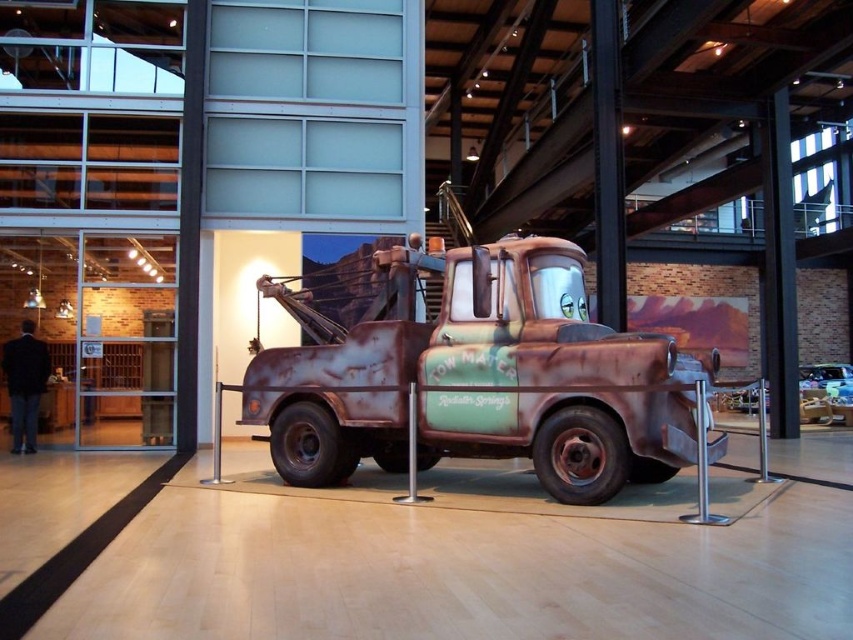
Question: Which point is farther to the camera?

Choices:
 (A) rusty metal tow truck at center
 (B) shiny silver car at center

Answer: (B)

Question: Is rusty metal tow truck at center below shiny silver car at center?

Choices:
 (A) no
 (B) yes

Answer: (A)

Question: Does rusty metal tow truck at center appear under shiny silver car at center?

Choices:
 (A) no
 (B) yes

Answer: (A)

Question: Is rusty metal tow truck at center wider than shiny silver car at center?

Choices:
 (A) no
 (B) yes

Answer: (B)